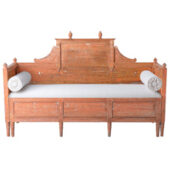
You are a GUI agent. You are given a task and a screenshot of the screen. Output one action in this format:
    pyautogui.click(x=<x>, y=<y>)
    Task: Click on the bench leg 6
    This screenshot has height=170, width=170.
    Given the screenshot: What is the action you would take?
    pyautogui.click(x=162, y=130)